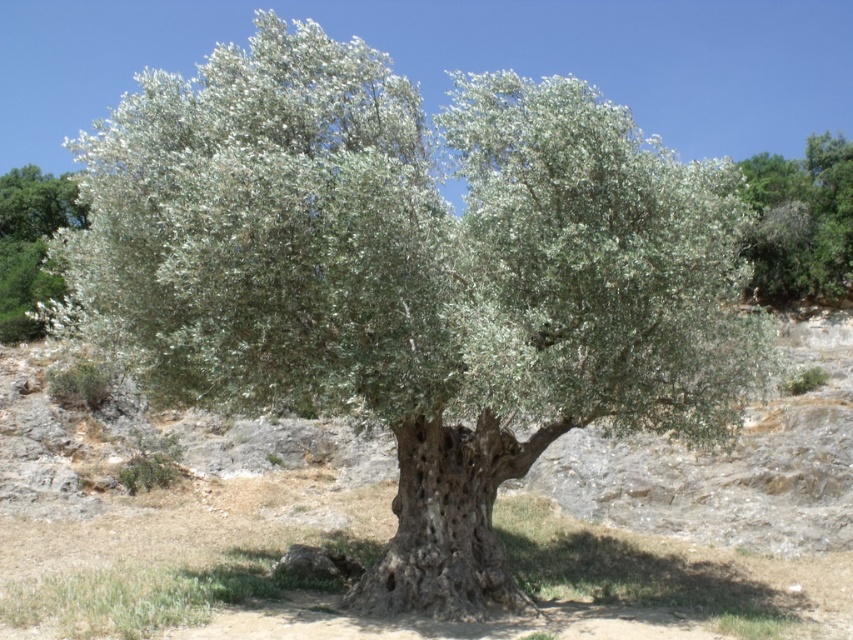
Question: Which object is closer to the camera taking this photo?

Choices:
 (A) green leafy tree at upper right
 (B) green leafy tree at upper left

Answer: (B)

Question: Does green leafy tree at upper right have a larger size compared to green leafy tree at upper left?

Choices:
 (A) no
 (B) yes

Answer: (B)

Question: Is green leafy tree at upper right to the right of green leafy tree at upper left from the viewer's perspective?

Choices:
 (A) yes
 (B) no

Answer: (A)

Question: Which object is farther from the camera taking this photo?

Choices:
 (A) green leafy tree at upper left
 (B) green leafy tree at upper right

Answer: (B)

Question: Does green leafy tree at upper right appear under green leafy tree at upper left?

Choices:
 (A) no
 (B) yes

Answer: (A)